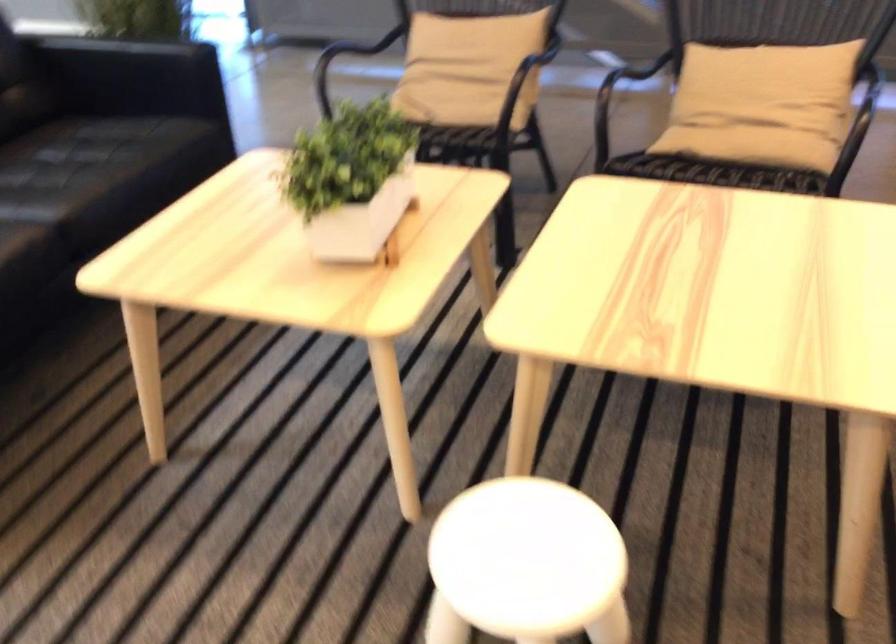
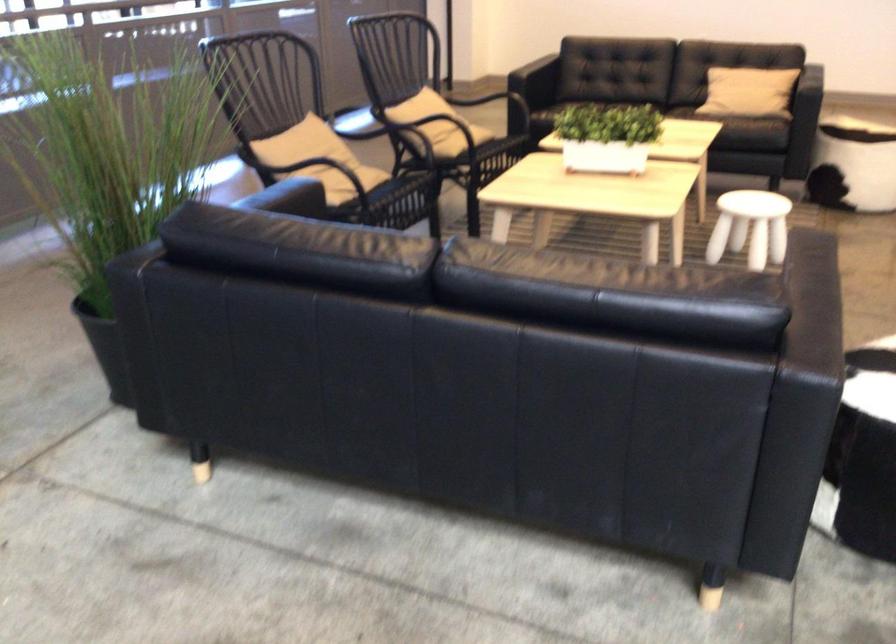
Find the pixel in the second image that matches point 367,178 in the first image.

(607, 137)